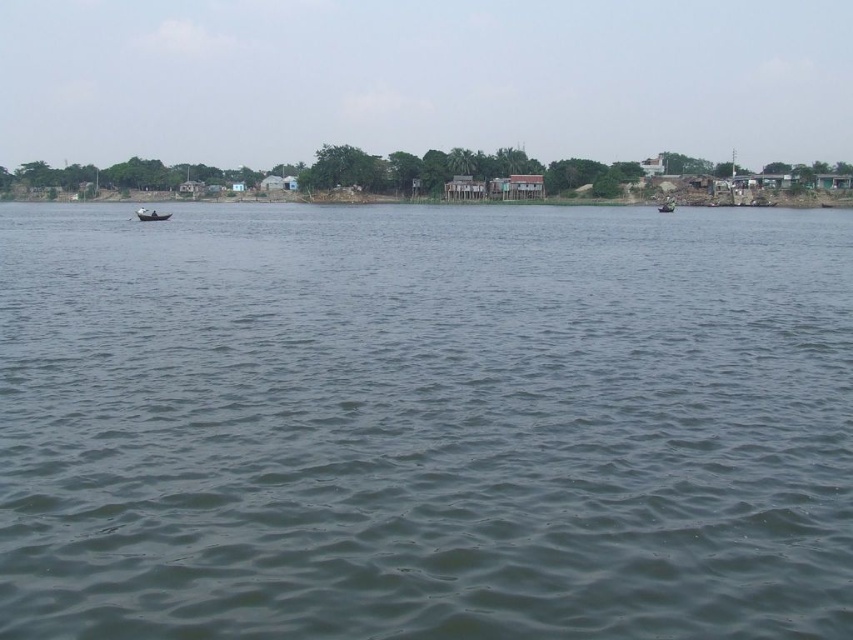
Is point (674, 419) positioned in front of point (671, 209)?

Yes.

Who is lower down, greenish water at center or green plastic boat at right?

greenish water at center is below.

At what (x,y) coordinates should I click in order to perform the action: click on greenish water at center. Please return your answer as a coordinate pair (x, y). Looking at the image, I should click on (424, 422).

Which of these two, wooden boat at left or green plastic boat at right, stands taller?

green plastic boat at right is taller.

Is wooden boat at left shorter than green plastic boat at right?

Yes.

Does point (154, 216) come in front of point (660, 204)?

Yes.

Find the location of a particular element. wooden boat at left is located at coordinates [x=149, y=214].

Does greenish water at center appear over wooden boat at left?

Actually, greenish water at center is below wooden boat at left.

Does greenish water at center appear on the left side of wooden boat at left?

No, greenish water at center is not to the left of wooden boat at left.

I want to click on greenish water at center, so click(424, 422).